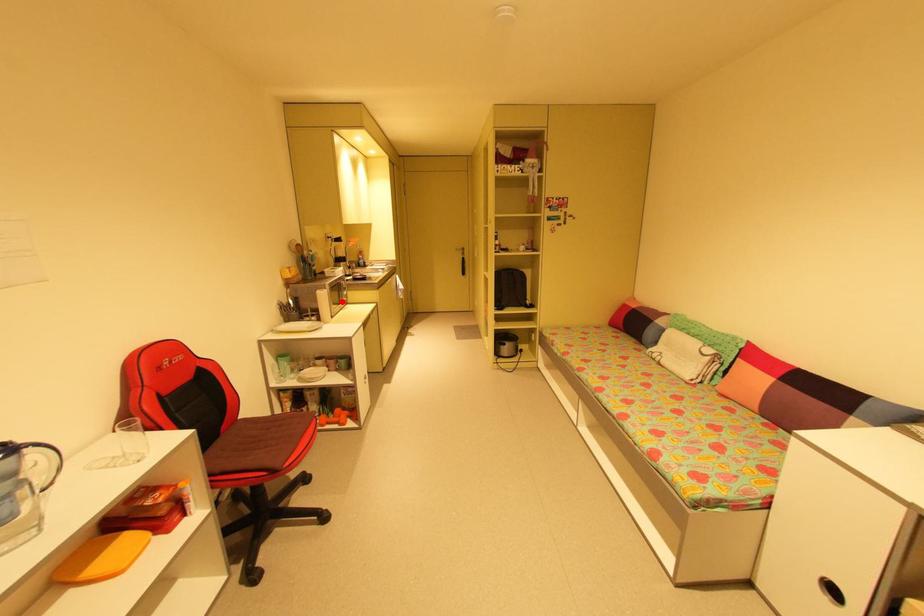
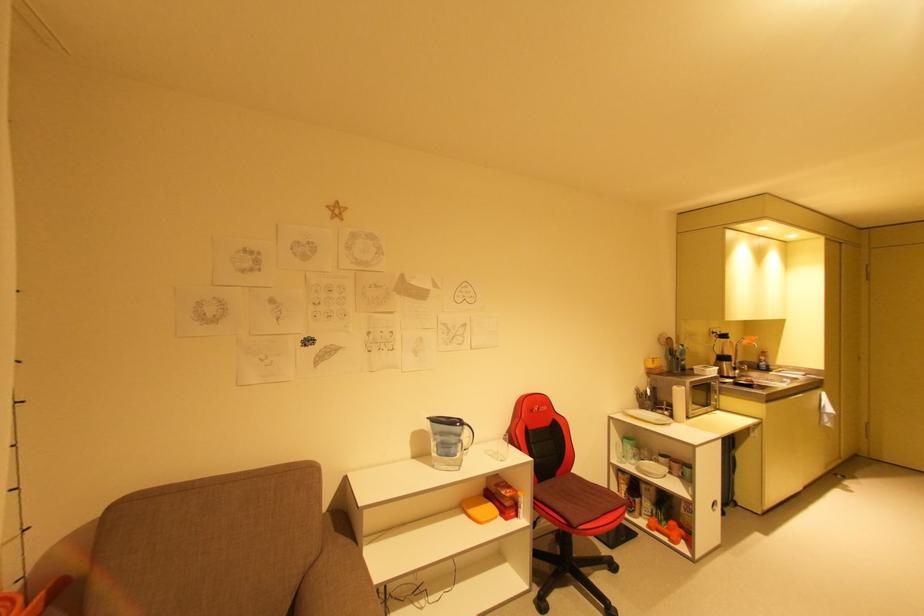
Find the pixel in the second image that matches the highlighted location in the first image.

(708, 403)